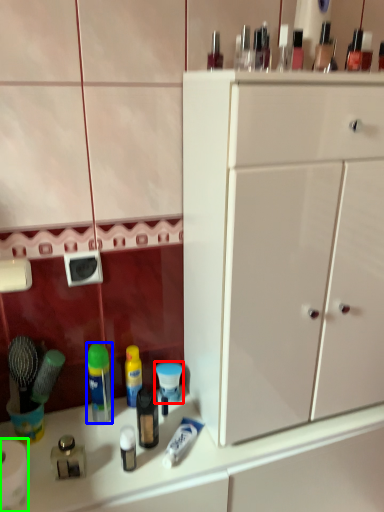
Question: Which object is the closest to the toiletry (highlighted by a red box)? Choose among these: mouthwash (highlighted by a blue box) or toilet paper (highlighted by a green box).

Choices:
 (A) mouthwash
 (B) toilet paper

Answer: (A)